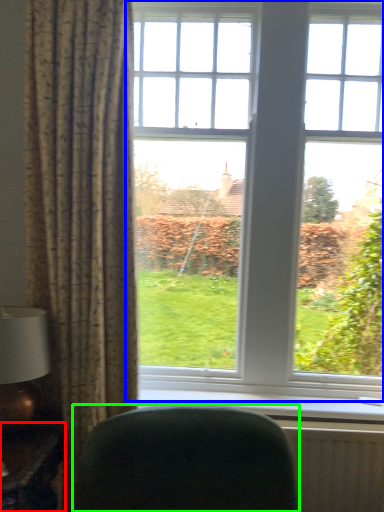
Question: Which object is positioned closest to table (highlighted by a red box)? Select from window (highlighted by a blue box) and furniture (highlighted by a green box).

Choices:
 (A) window
 (B) furniture

Answer: (B)